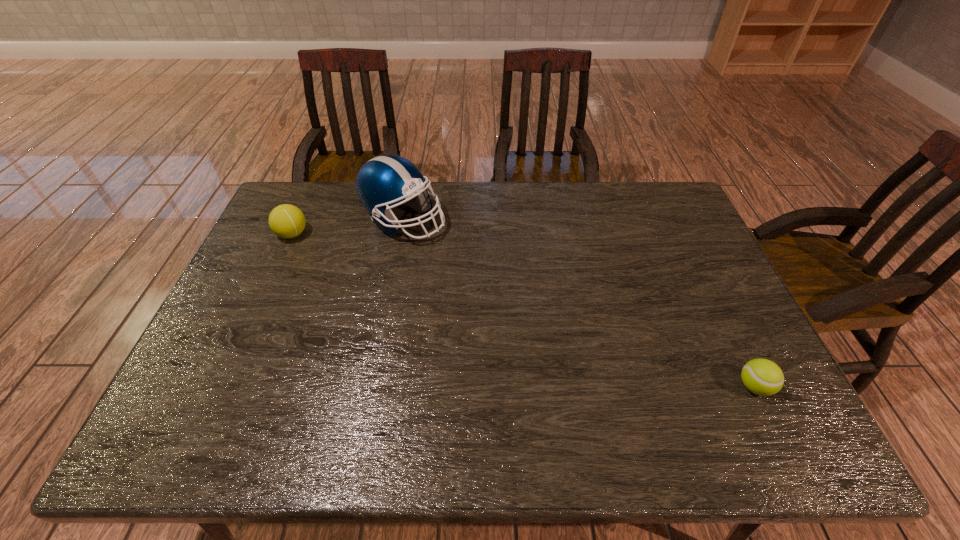
The width and height of the screenshot is (960, 540). Identify the location of object positioned at the left edge. (287, 221).

Locate an element on the screen. object at the right edge is located at coordinates (763, 377).

The height and width of the screenshot is (540, 960). I want to click on vacant space at the far edge of the desktop, so click(453, 184).

This screenshot has height=540, width=960. In the image, there is a desktop. What are the coordinates of `vacant space at the near edge` in the screenshot? It's located at (285, 428).

Where is `vacant region at the left edge of the desktop`? vacant region at the left edge of the desktop is located at coordinates (255, 296).

The width and height of the screenshot is (960, 540). I want to click on vacant space at the right edge of the desktop, so click(692, 280).

In the image, there is a desktop. Where is `vacant space at the far left corner`? This screenshot has height=540, width=960. vacant space at the far left corner is located at coordinates (300, 198).

In order to click on free location at the near left corner of the desktop in this screenshot , I will do `click(195, 432)`.

I want to click on unoccupied area between the left tennis ball and the rightmost object, so click(523, 310).

Identify the location of empty space that is in between the football helmet and the shorter tennis ball. This screenshot has width=960, height=540. (579, 303).